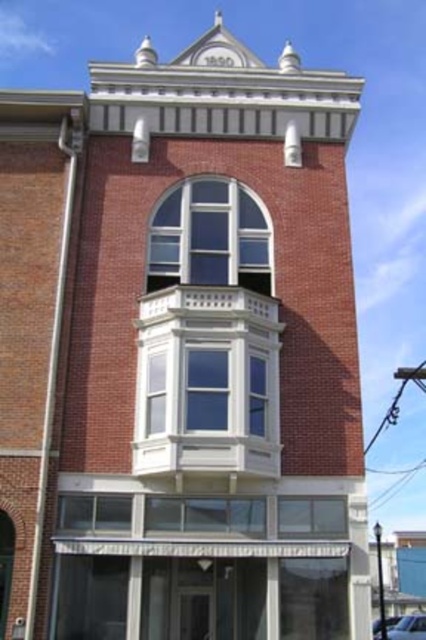
Does clear glass window at center have a greater width compared to clear glass window at lower center?

Yes.

Who is more distant from viewer, (201, 227) or (302, 534)?

The point (201, 227) is more distant.

This screenshot has width=426, height=640. What do you see at coordinates (209, 237) in the screenshot? I see `clear glass window at center` at bounding box center [209, 237].

In order to click on clear glass window at center in this screenshot , I will do `click(209, 237)`.